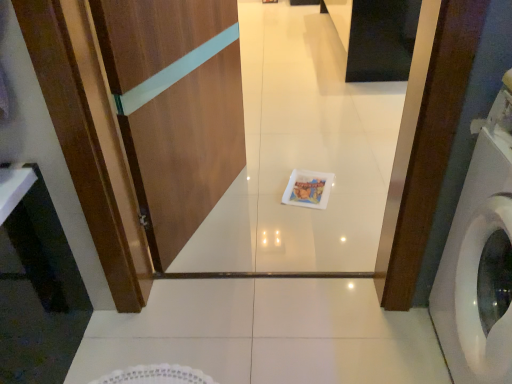
Locate an element on the screen. The width and height of the screenshot is (512, 384). spots to the right of wooden screen door at center is located at coordinates (305, 200).